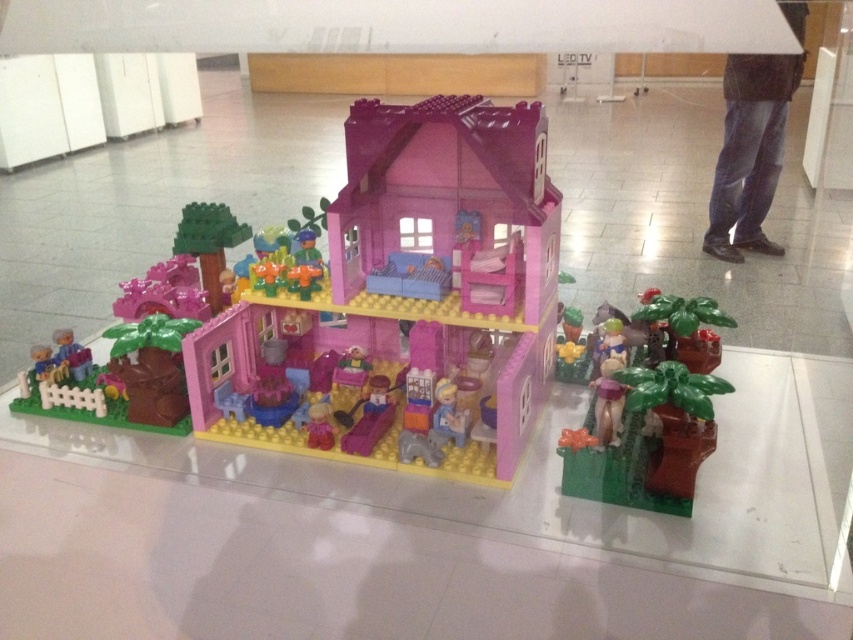
You are a visitor at the LEGO exhibition and want to know which of the two points, point (242, 294) or point (592, 480), is closer to you. Can you determine this based on their positions?

Point (242, 294) is closer to you than point (592, 480) because it is further to the viewer.